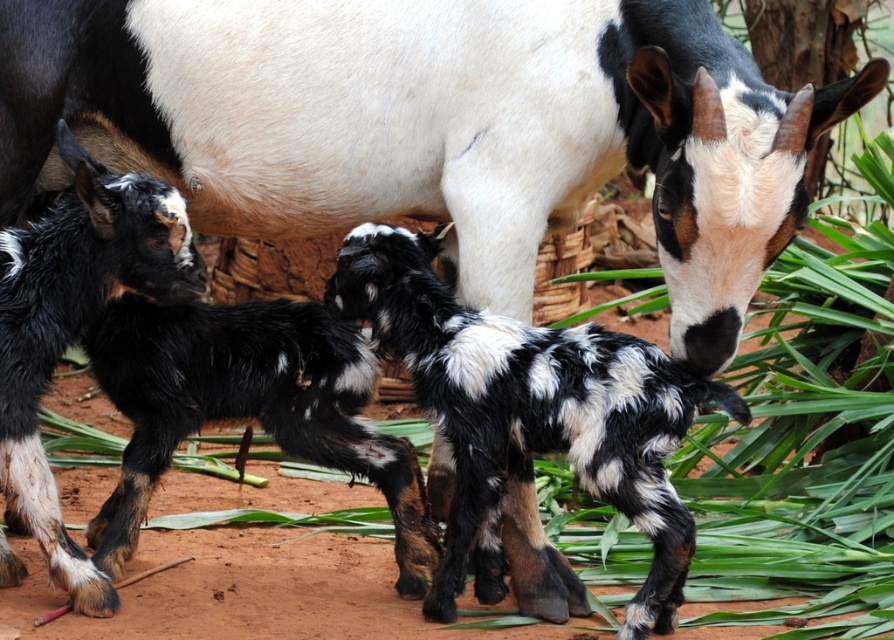
Question: Is spotted fur calf at center to the right of spotted fur kid goat at left from the viewer's perspective?

Choices:
 (A) yes
 (B) no

Answer: (A)

Question: Does spotted fur calf at center have a smaller size compared to spotted fur kid goat at left?

Choices:
 (A) yes
 (B) no

Answer: (B)

Question: Which point appears closest to the camera in this image?

Choices:
 (A) (524, 442)
 (B) (39, 257)

Answer: (A)

Question: Is spotted fur calf at center wider than spotted fur kid goat at left?

Choices:
 (A) no
 (B) yes

Answer: (B)

Question: Which of the following is the farthest from the observer?

Choices:
 (A) spotted fur kid goat at left
 (B) spotted fur calf at center

Answer: (A)